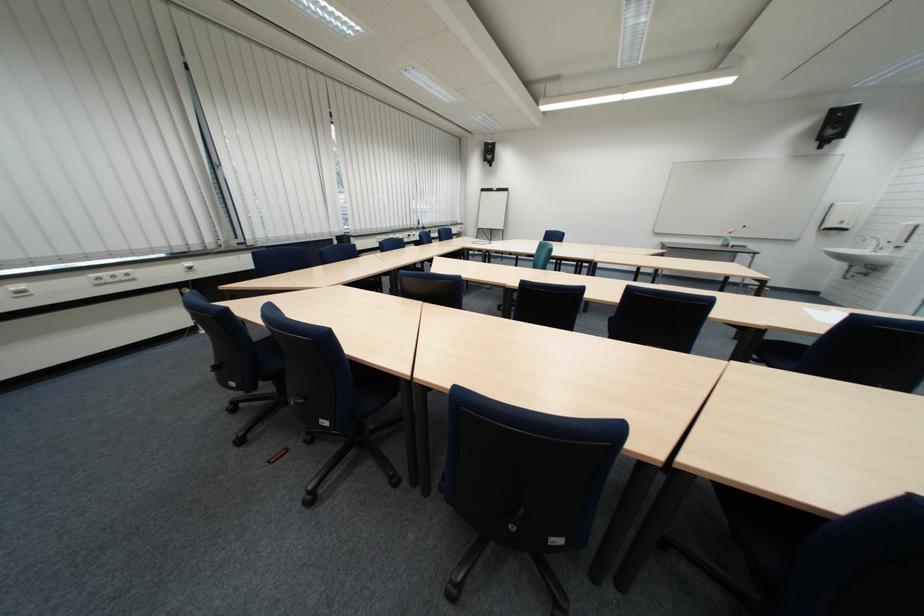
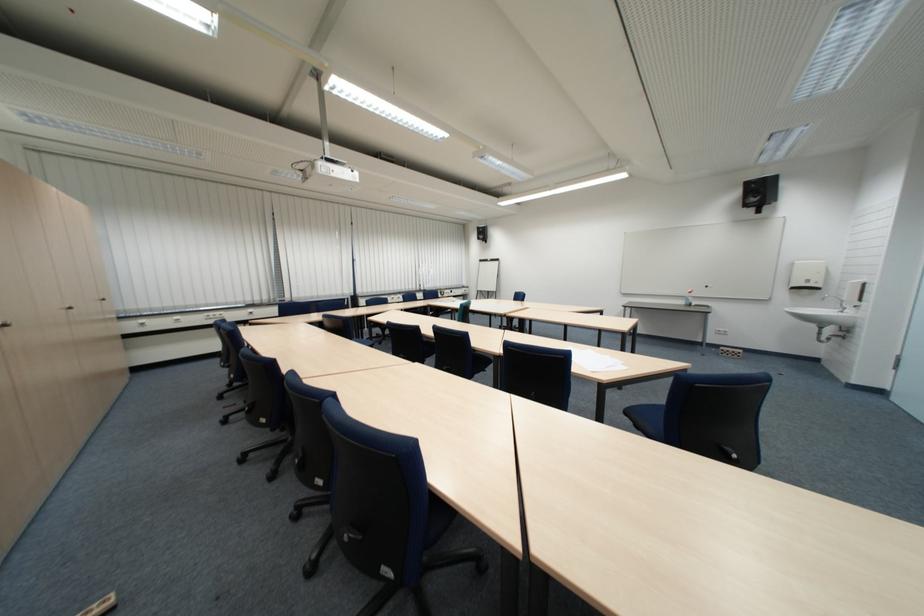
Locate, in the second image, the point that corresponds to pixel 733 244 in the first image.

(696, 302)